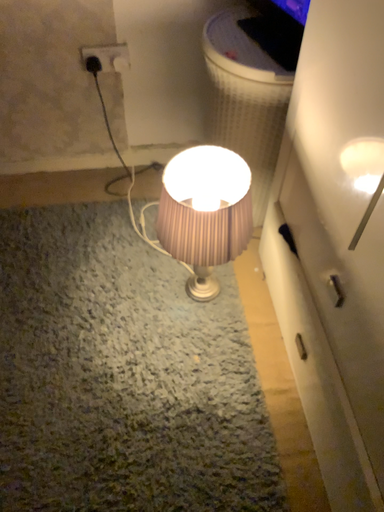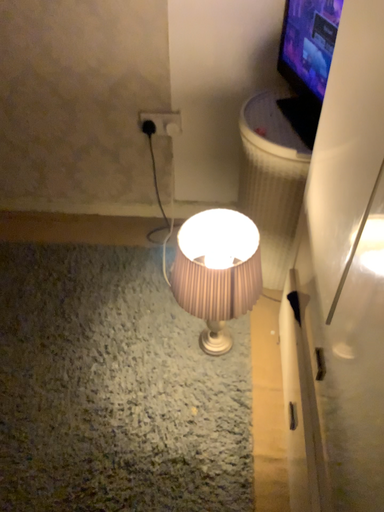
Question: Which way did the camera rotate in the video?

Choices:
 (A) rotated upward
 (B) rotated downward

Answer: (A)